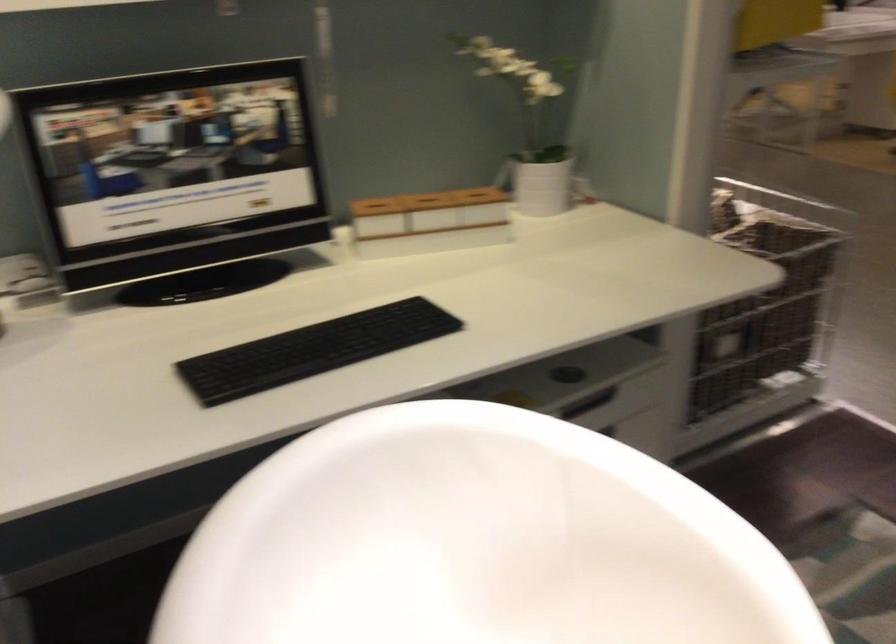
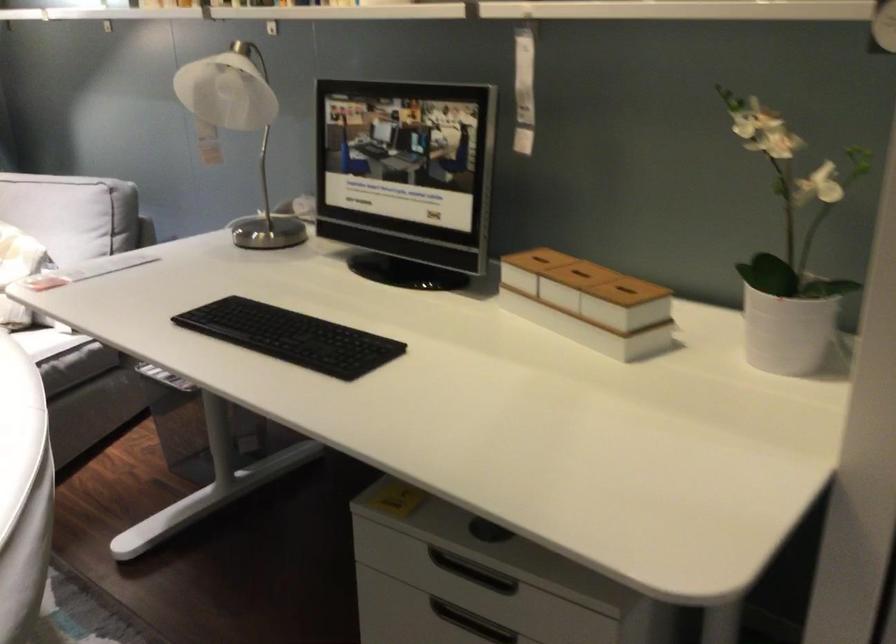
In the second image, find the point that corresponds to pixel 446 198 in the first image.

(579, 275)